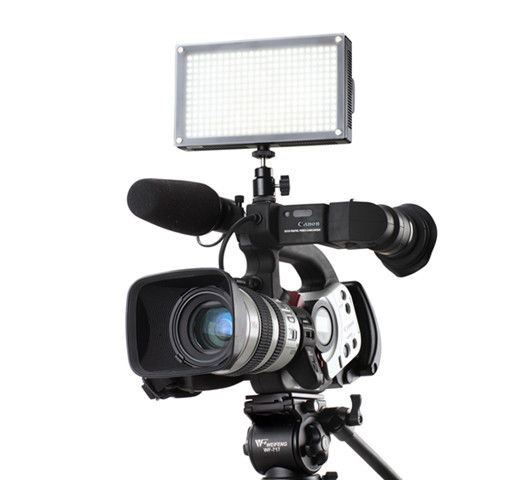
Where is `cable`? cable is located at coordinates [220, 254].